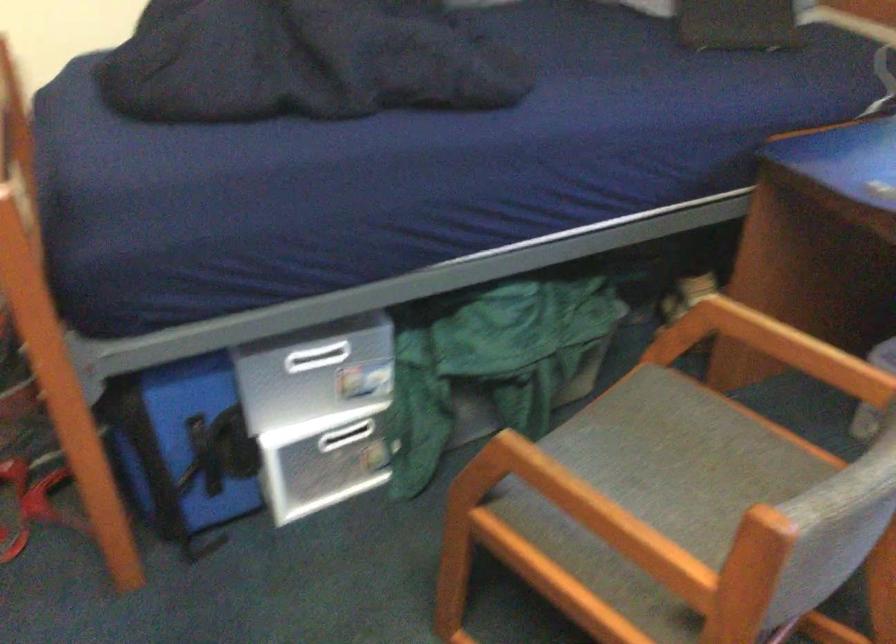
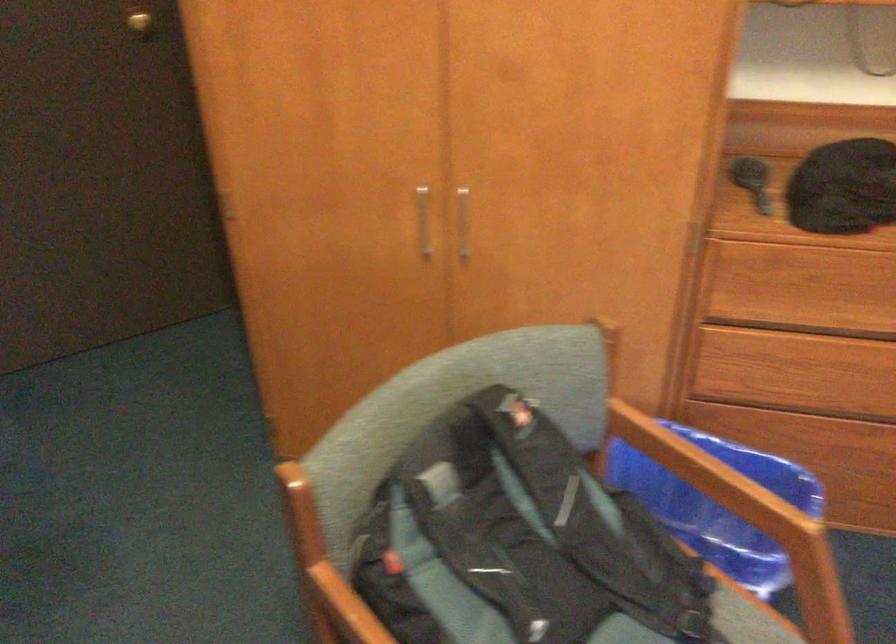
The images are taken continuously from a first-person perspective. In which direction is your viewpoint rotating?

The rotation direction of the camera is left-down.